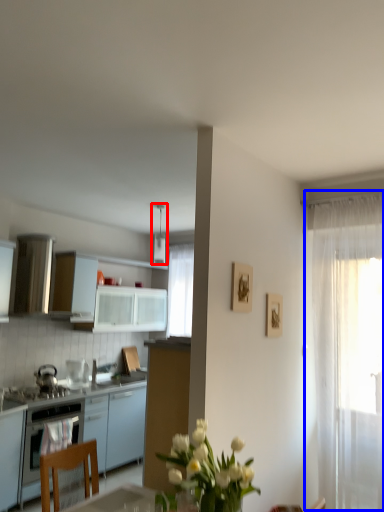
Question: Which object is further to the camera taking this photo, appliance (highlighted by a red box) or curtain (highlighted by a blue box)?

Choices:
 (A) appliance
 (B) curtain

Answer: (A)